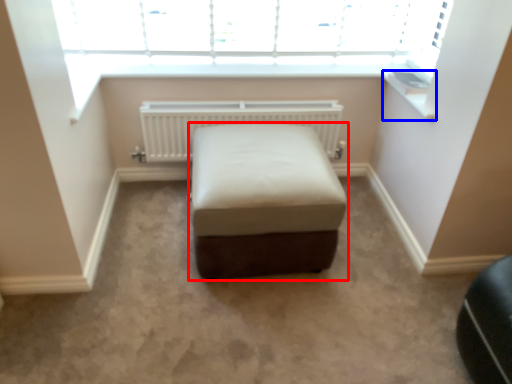
Question: Among these objects, which one is nearest to the camera, furniture (highlighted by a red box) or window sill (highlighted by a blue box)?

Choices:
 (A) furniture
 (B) window sill

Answer: (A)